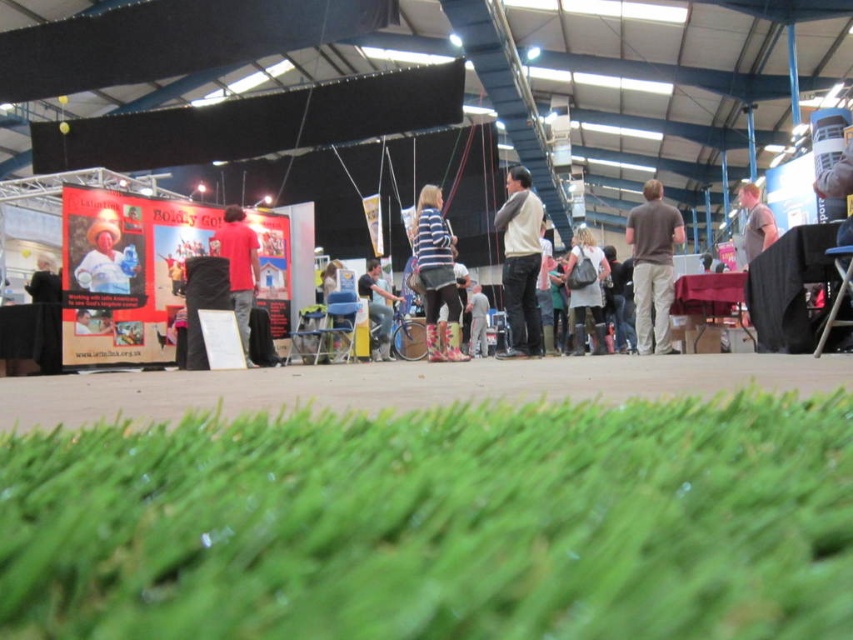
Question: Which point appears closest to the camera in this image?

Choices:
 (A) (653, 291)
 (B) (511, 196)

Answer: (B)

Question: Which point is closer to the camera taking this photo?

Choices:
 (A) (535, 308)
 (B) (596, 252)
 (C) (479, 340)

Answer: (A)

Question: Does light brown sweater at center appear over light gray fabric pants at center?

Choices:
 (A) yes
 (B) no

Answer: (A)

Question: Does light brown sweater at center appear under white textured coat at center?

Choices:
 (A) no
 (B) yes

Answer: (A)

Question: Estimate the real-world distances between objects in this image. Which object is closer to the red cotton shirt at center?

Choices:
 (A) light brown sweater at center
 (B) striped fabric shirt at center
 (C) green artificial turf at lower center
 (D) white textured coat at center

Answer: (B)

Question: Is green artificial turf at lower center bigger than brown cotton shirt at center?

Choices:
 (A) no
 (B) yes

Answer: (A)